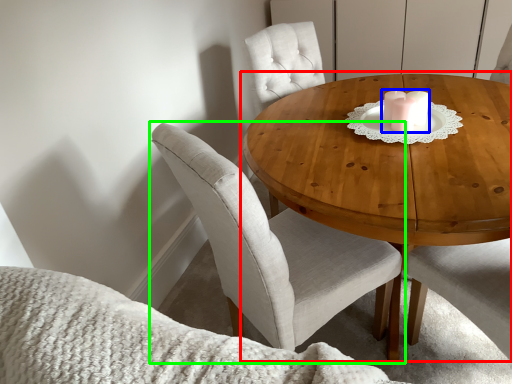
Question: Which is nearer to the coffee table (highlighted by a red box)? candle holder (highlighted by a blue box) or chair (highlighted by a green box).

Choices:
 (A) candle holder
 (B) chair

Answer: (A)